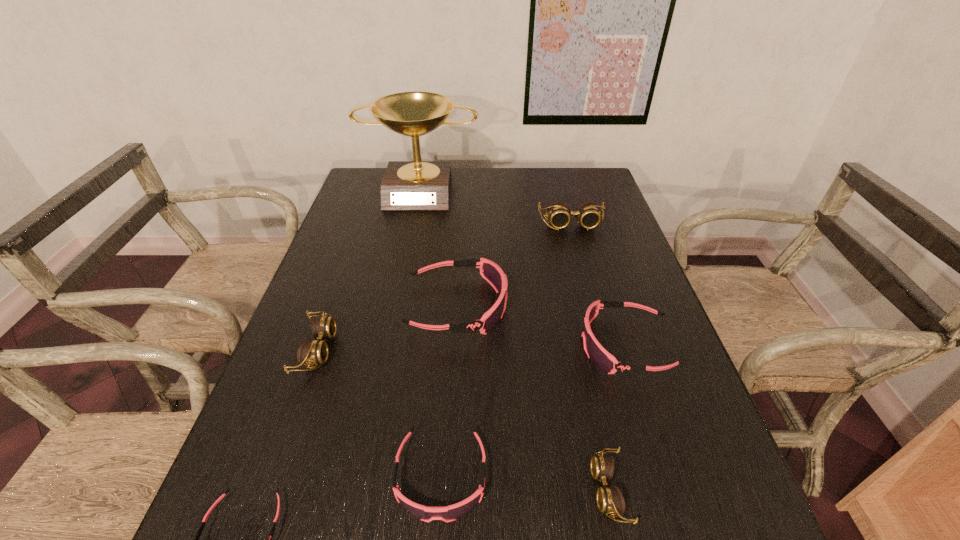
Locate an element on the screen. The width and height of the screenshot is (960, 540). pink goggles that is the second closest one to the second farthest object is located at coordinates (595, 351).

The width and height of the screenshot is (960, 540). I want to click on pink goggles that can be found as the closest to the rightmost pink goggles, so (491, 272).

Where is `brown goggles that is the second nearest to the second farthest brown goggles`? This screenshot has width=960, height=540. brown goggles that is the second nearest to the second farthest brown goggles is located at coordinates [587, 214].

Find the location of `the second closest brown goggles to the nearest brown goggles`. the second closest brown goggles to the nearest brown goggles is located at coordinates (587, 214).

Where is `free space that satisfies the following two spatial constraints: 1. on the front-facing side of the biggest pink goggles; 2. on the front-facing side of the third biggest pink goggles`? This screenshot has height=540, width=960. free space that satisfies the following two spatial constraints: 1. on the front-facing side of the biggest pink goggles; 2. on the front-facing side of the third biggest pink goggles is located at coordinates (447, 476).

At what (x,y) coordinates should I click in order to perform the action: click on free region that satisfies the following two spatial constraints: 1. on the front-facing side of the biggest pink goggles; 2. on the front-facing side of the second smallest pink goggles. Please return your answer as a coordinate pair (x, y). The height and width of the screenshot is (540, 960). Looking at the image, I should click on [447, 476].

Find the location of a particular element. The height and width of the screenshot is (540, 960). vacant space that satisfies the following two spatial constraints: 1. through the lenses of the farthest goggles; 2. through the lenses of the second nearest brown goggles is located at coordinates (606, 349).